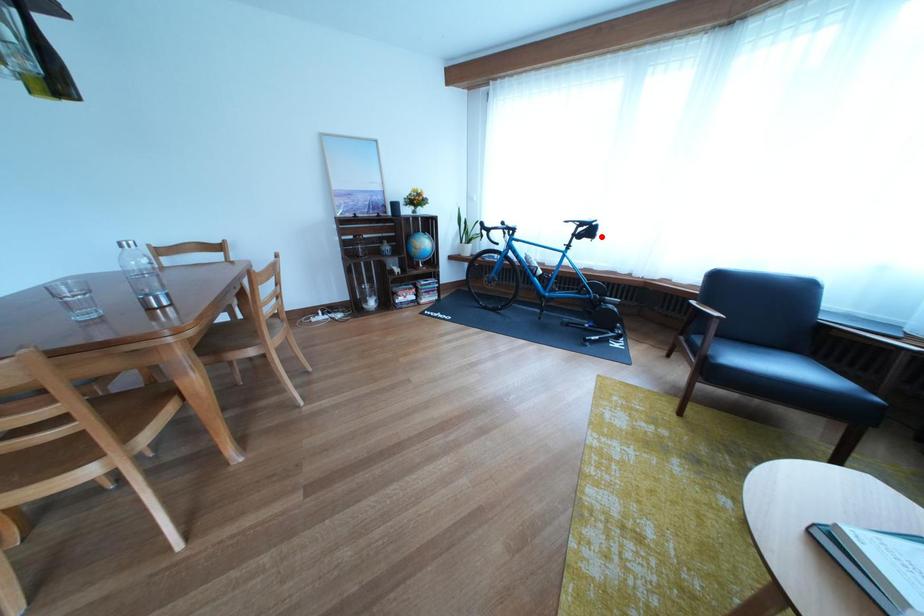
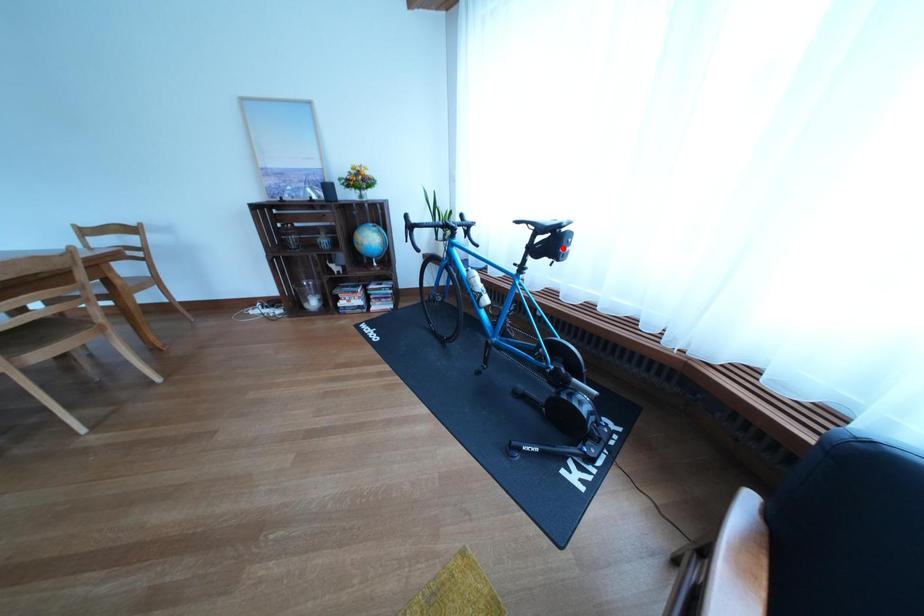
I am providing you with two images of the same scene from different viewpoints. A red point is marked on the first image and another point is marked on the second image. Do the highlighted points in image1 and image2 indicate the same real-world spot?

Yes